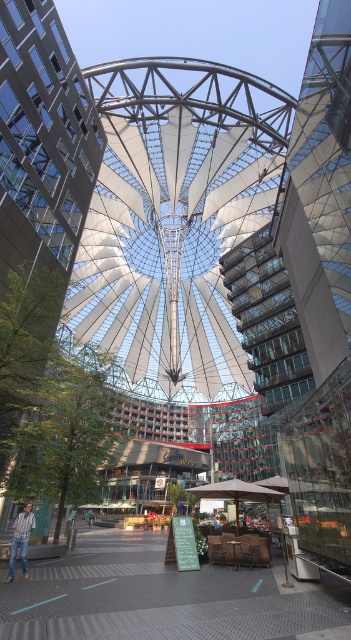
Question: Is transparent glass tower at center thinner than glassy modern building at center?

Choices:
 (A) no
 (B) yes

Answer: (A)

Question: Where is transparent glass tower at center located in relation to glassy modern building at center in the image?

Choices:
 (A) right
 (B) left

Answer: (A)

Question: Among these points, which one is nearest to the camera?

Choices:
 (A) (24, 104)
 (B) (343, 177)

Answer: (B)

Question: In this image, where is transparent glass tower at center located relative to glassy modern building at center?

Choices:
 (A) left
 (B) right

Answer: (B)

Question: Which point is closer to the camera?

Choices:
 (A) (348, 532)
 (B) (51, 93)

Answer: (A)